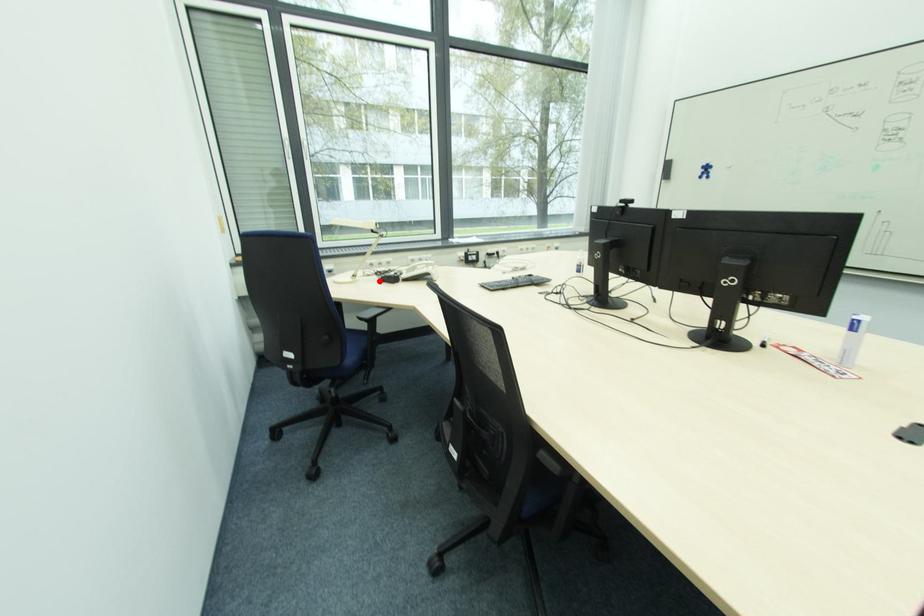
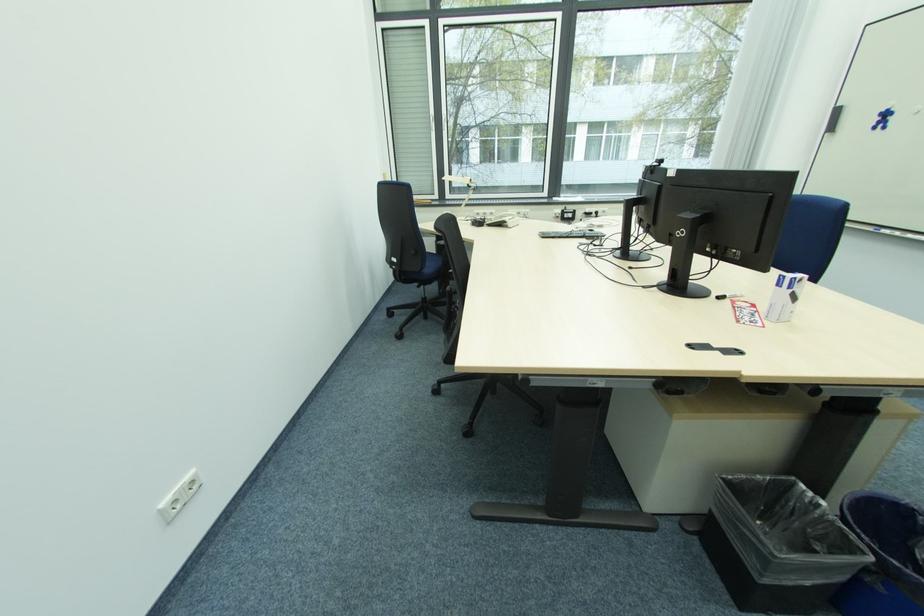
Where in the second image is the point corresponding to the highlighted location from the first image?

(472, 225)